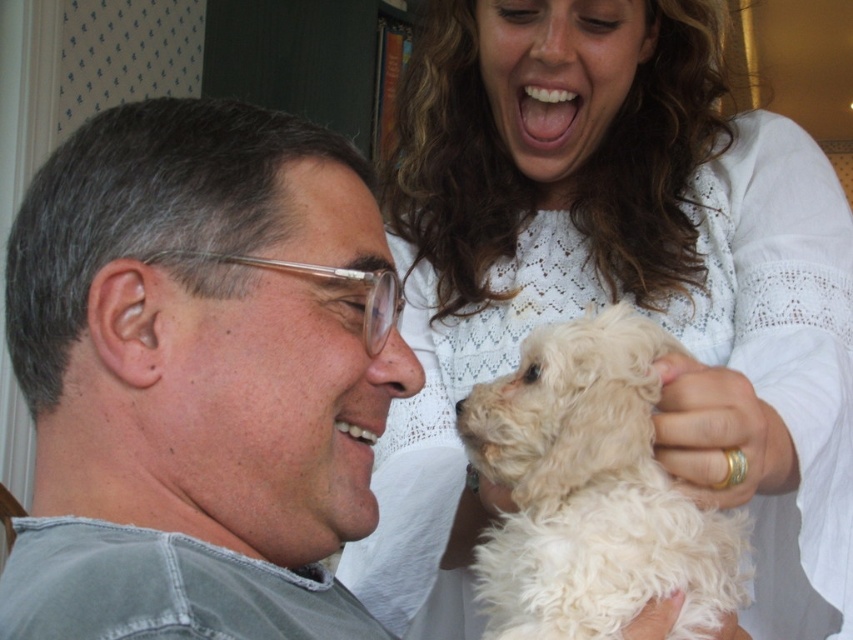
Question: Estimate the real-world distances between objects in this image. Which object is closer to the white lace sweater at upper center?

Choices:
 (A) white fluffy dog at upper right
 (B) gray denim shirt at left

Answer: (A)

Question: Which point appears closest to the camera in this image?

Choices:
 (A) (666, 298)
 (B) (186, 132)
 (C) (659, 467)

Answer: (B)

Question: Does white lace sweater at upper center have a smaller size compared to gray denim shirt at left?

Choices:
 (A) no
 (B) yes

Answer: (A)

Question: Which point is closer to the camera taking this photo?

Choices:
 (A) (485, 401)
 (B) (16, 339)

Answer: (B)

Question: Does white lace sweater at upper center have a smaller size compared to gray denim shirt at left?

Choices:
 (A) no
 (B) yes

Answer: (A)

Question: Does gray denim shirt at left have a greater width compared to white fluffy dog at upper right?

Choices:
 (A) no
 (B) yes

Answer: (A)